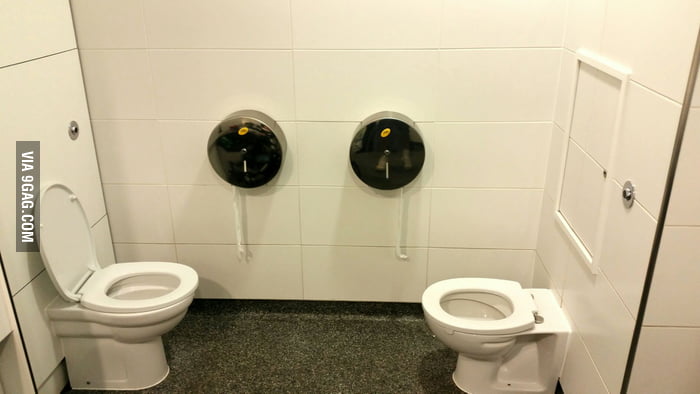
This screenshot has width=700, height=394. Identify the location of flush button. (75, 130), (624, 192).